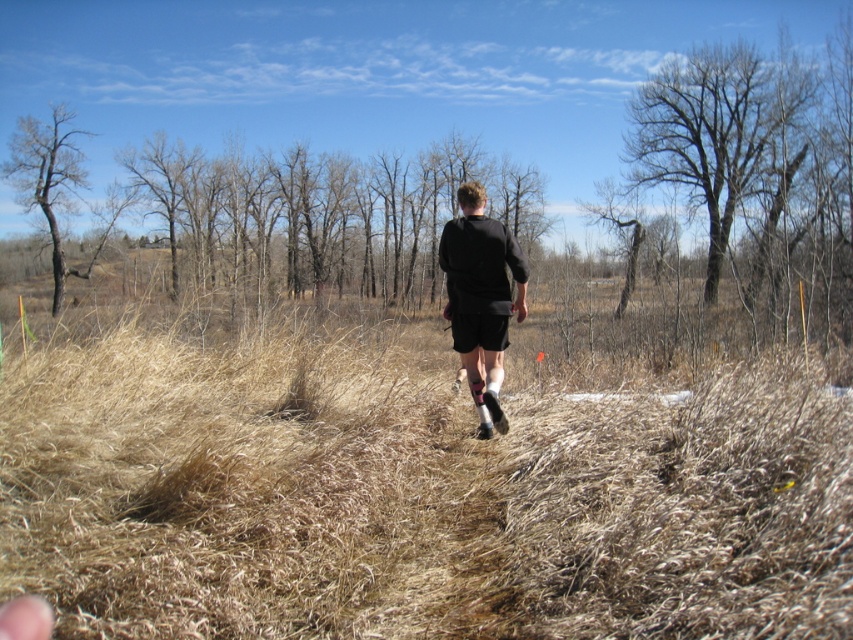
Question: Considering the real-world distances, which object is closest to the brown bark tree at left?

Choices:
 (A) bare branches at center
 (B) black matte shorts at center

Answer: (A)

Question: In this image, where is brown dry grass at center located relative to bare wood tree at upper right?

Choices:
 (A) above
 (B) below

Answer: (B)

Question: Does brown dry grass at center have a lesser width compared to brown bark tree at left?

Choices:
 (A) yes
 (B) no

Answer: (B)

Question: Among these points, which one is nearest to the camera?

Choices:
 (A) (254, 170)
 (B) (746, 58)
 (C) (19, 148)

Answer: (B)

Question: Estimate the real-world distances between objects in this image. Which object is closer to the brown dry grass at center?

Choices:
 (A) brown bark tree at left
 (B) black matte shorts at center
 (C) bare branches at center

Answer: (B)

Question: Is bare branches at center to the left of black matte shorts at center from the viewer's perspective?

Choices:
 (A) no
 (B) yes

Answer: (B)